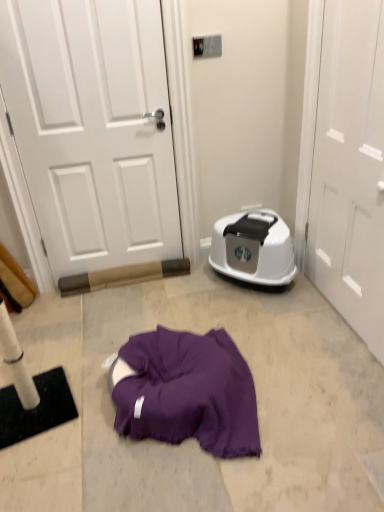
The width and height of the screenshot is (384, 512). What are the coordinates of `white glossy dishwasher at right` in the screenshot? It's located at (253, 248).

This screenshot has height=512, width=384. Describe the element at coordinates (93, 129) in the screenshot. I see `white matte door at upper left, which is the 2th door from right to left` at that location.

The image size is (384, 512). Describe the element at coordinates (350, 168) in the screenshot. I see `white glossy door at right, the second door from the left` at that location.

Identify the location of white glossy dishwasher at right. The height and width of the screenshot is (512, 384). (253, 248).

From a real-world perspective, which door is the 2nd one above the white glossy dishwasher at right? Please provide its 2D coordinates.

[(93, 129)]

Who is shorter, white glossy dishwasher at right or white matte door at upper left, which is counted as the 1th door, starting from the left?

white glossy dishwasher at right is shorter.

In the scene shown: From a real-world perspective, is white glossy dishwasher at right physically located above or below white matte door at upper left, which is the 2th door from right to left?

white glossy dishwasher at right is below white matte door at upper left, which is the 2th door from right to left.

From the image's perspective, relative to white matte door at upper left, which is counted as the 1th door, starting from the left, is white glossy dishwasher at right above or below?

From the image's perspective, white glossy dishwasher at right appears below white matte door at upper left, which is counted as the 1th door, starting from the left.

Which is nearer, (292, 248) or (372, 326)?

Point (292, 248).

Between white glossy dishwasher at right and white glossy door at right, the first door in the right-to-left sequence, which one appears on the right side from the viewer's perspective?

From the viewer's perspective, white glossy door at right, the first door in the right-to-left sequence, appears more on the right side.

From the picture: How different are the orientations of white glossy dishwasher at right and white glossy door at right, the first door in the right-to-left sequence, in degrees?

The facing directions of white glossy dishwasher at right and white glossy door at right, the first door in the right-to-left sequence, are 47 degrees apart.

Considering the relative positions of white glossy door at right, the second door from the left, and white glossy dishwasher at right in the image provided, is white glossy door at right, the second door from the left, to the left of white glossy dishwasher at right from the viewer's perspective?

No, white glossy door at right, the second door from the left, is not to the left of white glossy dishwasher at right.

Considering the relative sizes of white glossy door at right, the second door from the left, and white glossy dishwasher at right in the image provided, is white glossy door at right, the second door from the left, wider than white glossy dishwasher at right?

No, white glossy door at right, the second door from the left, is not wider than white glossy dishwasher at right.

Considering the positions of point (357, 141) and point (268, 280), is point (357, 141) closer or farther from the camera than point (268, 280)?

Clearly, point (357, 141) is closer to the camera than point (268, 280).

Does point (51, 238) come farther from viewer compared to point (295, 269)?

Yes, point (51, 238) is farther from viewer.

Between white matte door at upper left, which is the 2th door from right to left, and white glossy dishwasher at right, which one is positioned behind?

Positioned behind is white glossy dishwasher at right.

Considering the sizes of objects white matte door at upper left, which is counted as the 1th door, starting from the left, and white glossy dishwasher at right in the image provided, who is bigger, white matte door at upper left, which is counted as the 1th door, starting from the left, or white glossy dishwasher at right?

With larger size is white glossy dishwasher at right.

Between white matte door at upper left, which is counted as the 1th door, starting from the left, and white glossy dishwasher at right, which one has more height?

Standing taller between the two is white matte door at upper left, which is counted as the 1th door, starting from the left.

Considering the relative sizes of white matte door at upper left, which is counted as the 1th door, starting from the left, and white glossy door at right, the first door in the right-to-left sequence, in the image provided, is white matte door at upper left, which is counted as the 1th door, starting from the left, shorter than white glossy door at right, the first door in the right-to-left sequence,?

No, white matte door at upper left, which is counted as the 1th door, starting from the left, is not shorter than white glossy door at right, the first door in the right-to-left sequence.

Looking at this image, is white matte door at upper left, which is counted as the 1th door, starting from the left, next to white glossy door at right, the first door in the right-to-left sequence, and touching it?

white matte door at upper left, which is counted as the 1th door, starting from the left, is not next to white glossy door at right, the first door in the right-to-left sequence, and they're not touching.

Do you think white matte door at upper left, which is the 2th door from right to left, is within white glossy door at right, the first door in the right-to-left sequence, or outside of it?

white matte door at upper left, which is the 2th door from right to left, cannot be found inside white glossy door at right, the first door in the right-to-left sequence.

Based on their sizes in the image, would you say white matte door at upper left, which is the 2th door from right to left, is bigger or smaller than white glossy door at right, the first door in the right-to-left sequence?

white matte door at upper left, which is the 2th door from right to left, is bigger than white glossy door at right, the first door in the right-to-left sequence.

Choose the correct answer: Is white glossy door at right, the second door from the left, inside white matte door at upper left, which is counted as the 1th door, starting from the left, or outside it?

white glossy door at right, the second door from the left, cannot be found inside white matte door at upper left, which is counted as the 1th door, starting from the left.

Between white glossy door at right, the second door from the left, and white matte door at upper left, which is counted as the 1th door, starting from the left, which one has less height?

Standing shorter between the two is white glossy door at right, the second door from the left.

Considering the relative sizes of white glossy door at right, the second door from the left, and white matte door at upper left, which is the 2th door from right to left, in the image provided, is white glossy door at right, the second door from the left, bigger than white matte door at upper left, which is the 2th door from right to left,?

Actually, white glossy door at right, the second door from the left, might be smaller than white matte door at upper left, which is the 2th door from right to left.

Does white glossy door at right, the second door from the left, have a greater width compared to white matte door at upper left, which is counted as the 1th door, starting from the left?

In fact, white glossy door at right, the second door from the left, might be narrower than white matte door at upper left, which is counted as the 1th door, starting from the left.

Locate an element on the screen. This screenshot has height=512, width=384. dish washer on the right of white matte door at upper left, which is the 2th door from right to left is located at coordinates (253, 248).

Find the location of a particular element. This screenshot has height=512, width=384. dish washer directly beneath the white glossy door at right, the first door in the right-to-left sequence (from a real-world perspective) is located at coordinates (253, 248).

Looking at the image, which one is located closer to white glossy door at right, the second door from the left, white matte door at upper left, which is counted as the 1th door, starting from the left, or white glossy dishwasher at right?

Among the two, white glossy dishwasher at right is located nearer to white glossy door at right, the second door from the left.

Which object lies further to the anchor point white glossy door at right, the first door in the right-to-left sequence, white glossy dishwasher at right or white matte door at upper left, which is counted as the 1th door, starting from the left?

white matte door at upper left, which is counted as the 1th door, starting from the left, lies further to white glossy door at right, the first door in the right-to-left sequence, than the other object.

Based on their spatial positions, is white glossy door at right, the second door from the left, or white glossy dishwasher at right further from white matte door at upper left, which is the 2th door from right to left?

The object further to white matte door at upper left, which is the 2th door from right to left, is white glossy door at right, the second door from the left.

Looking at this image, considering their positions, is white glossy door at right, the first door in the right-to-left sequence, positioned further to white glossy dishwasher at right than white matte door at upper left, which is the 2th door from right to left?

white matte door at upper left, which is the 2th door from right to left.

Looking at the image, which one is located closer to white matte door at upper left, which is the 2th door from right to left, white glossy dishwasher at right or white glossy door at right, the second door from the left?

white glossy dishwasher at right.

Based on their spatial positions, is white matte door at upper left, which is counted as the 1th door, starting from the left, or white glossy door at right, the first door in the right-to-left sequence, further from white glossy dishwasher at right?

The object further to white glossy dishwasher at right is white matte door at upper left, which is counted as the 1th door, starting from the left.

Where is `dish washer between white matte door at upper left, which is counted as the 1th door, starting from the left, and white glossy door at right, the second door from the left`? This screenshot has height=512, width=384. dish washer between white matte door at upper left, which is counted as the 1th door, starting from the left, and white glossy door at right, the second door from the left is located at coordinates (253, 248).